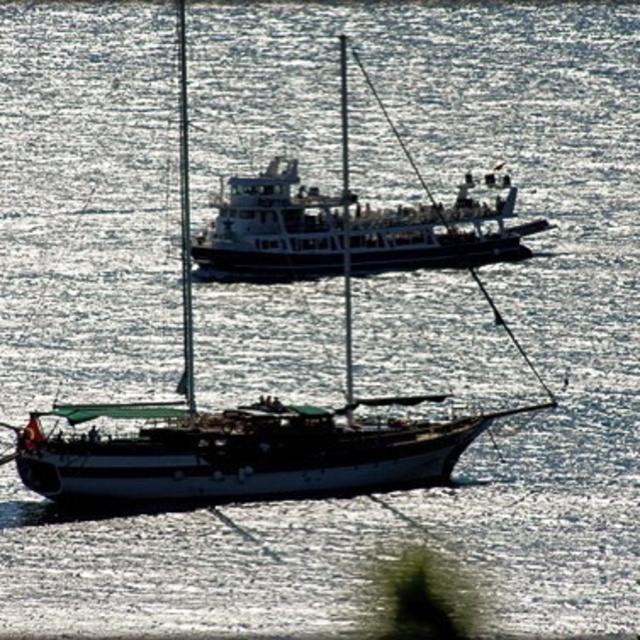
You are a passenger on the white matte sailboat at lower center and want to move towards the white matte boat at center. Which direction should you head to reach it?

The white matte sailboat at lower center is positioned on the left side of the white matte boat at center, so you should head to the right to reach it.

You are standing on the deck of the white matte sailboat at lower center and want to see the white matte boat at center. In which direction should you look relative to your current position?

You should look downward because the white matte sailboat at lower center is above the white matte boat at center.